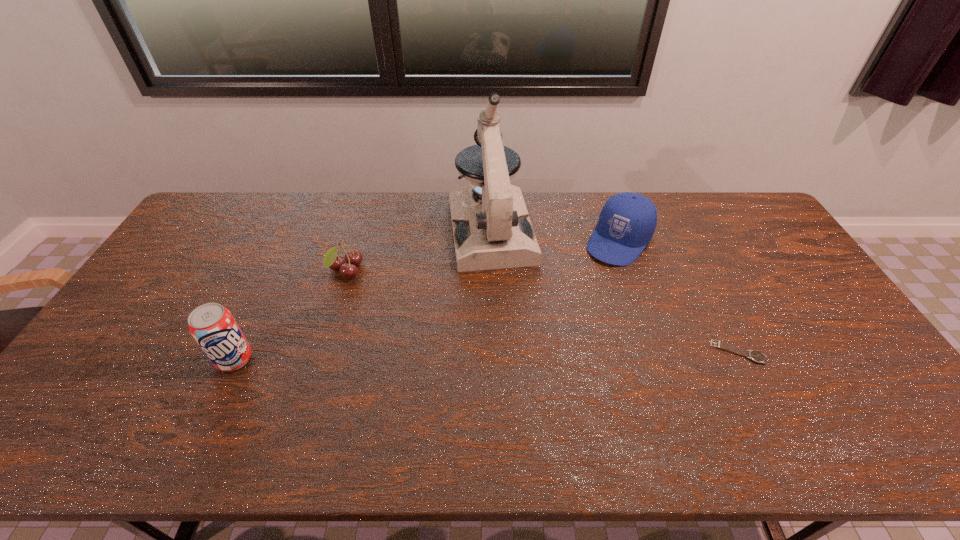
Where is `the leftmost object`? the leftmost object is located at coordinates (213, 327).

The height and width of the screenshot is (540, 960). Identify the location of the rightmost object. (756, 356).

Identify the location of watch. (756, 356).

The image size is (960, 540). In order to click on the fourth tallest object in this screenshot , I will do `click(353, 257)`.

Find the location of a particular element. the fourth object from right to left is located at coordinates (353, 257).

Image resolution: width=960 pixels, height=540 pixels. I want to click on the tallest object, so click(491, 226).

The width and height of the screenshot is (960, 540). Identify the location of microscope. (491, 226).

At what (x,y) coordinates should I click in order to perform the action: click on cap. Please return your answer as a coordinate pair (x, y). Looking at the image, I should click on (627, 221).

You are a GUI agent. You are given a task and a screenshot of the screen. Output one action in this format:
    pyautogui.click(x=<x>, y=<y>)
    Task: Click on the third shortest object
    Image resolution: width=960 pixels, height=540 pixels.
    Given the screenshot: What is the action you would take?
    pyautogui.click(x=627, y=221)

Identify the location of vacant space located on the left of the leftmost object. (164, 359).